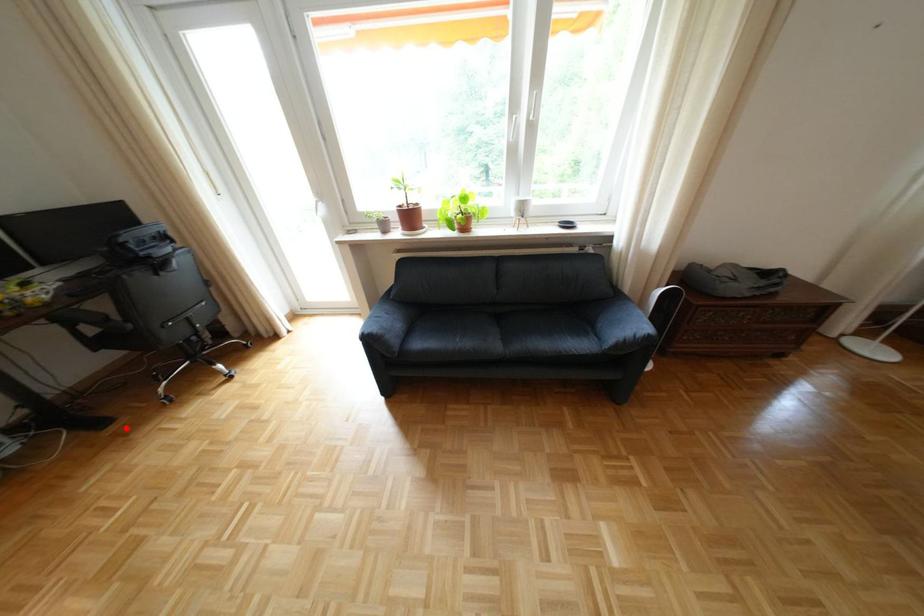
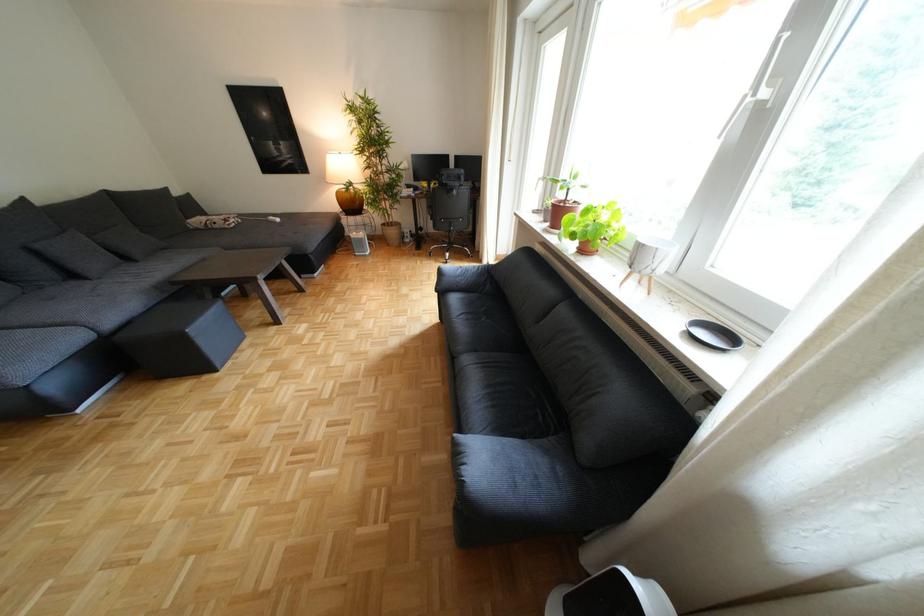
Question: I am providing you with two images of the same scene from different viewpoints. Given a red point in image1, look at the same physical point in image2. Is it:

Choices:
 (A) Closer to the viewpoint
 (B) Farther from the viewpoint

Answer: (A)